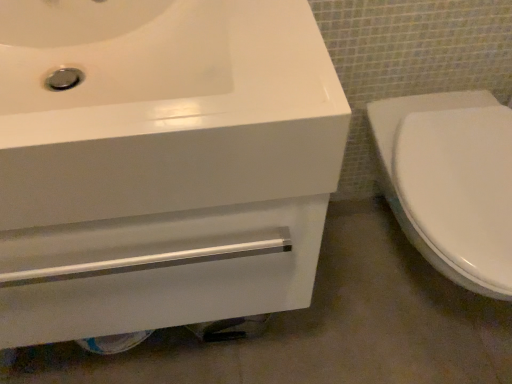
Question: From a real-world perspective, is white glossy toilet at right below white glossy drawer at lower left?

Choices:
 (A) no
 (B) yes

Answer: (A)

Question: Are white glossy toilet at right and white glossy drawer at lower left far apart?

Choices:
 (A) no
 (B) yes

Answer: (A)

Question: Does white glossy toilet at right lie behind white glossy drawer at lower left?

Choices:
 (A) no
 (B) yes

Answer: (A)

Question: From the image's perspective, would you say white glossy toilet at right is positioned over white glossy drawer at lower left?

Choices:
 (A) no
 (B) yes

Answer: (B)

Question: Would you say white glossy toilet at right is outside white glossy drawer at lower left?

Choices:
 (A) no
 (B) yes

Answer: (B)

Question: Looking at the image, does white glossy toilet at right seem bigger or smaller compared to white glossy sink at upper left?

Choices:
 (A) small
 (B) big

Answer: (A)

Question: Considering the positions of white glossy toilet at right and white glossy sink at upper left in the image, is white glossy toilet at right wider or thinner than white glossy sink at upper left?

Choices:
 (A) wide
 (B) thin

Answer: (A)

Question: From the image's perspective, relative to white glossy sink at upper left, is white glossy toilet at right above or below?

Choices:
 (A) above
 (B) below

Answer: (B)

Question: Is white glossy toilet at right situated inside white glossy sink at upper left or outside?

Choices:
 (A) outside
 (B) inside

Answer: (A)

Question: From a real-world perspective, relative to white glossy toilet at right, is white glossy sink at upper left vertically above or below?

Choices:
 (A) above
 (B) below

Answer: (A)

Question: Is white glossy sink at upper left taller or shorter than white glossy toilet at right?

Choices:
 (A) short
 (B) tall

Answer: (A)

Question: Considering the positions of white glossy sink at upper left and white glossy toilet at right in the image, is white glossy sink at upper left wider or thinner than white glossy toilet at right?

Choices:
 (A) thin
 (B) wide

Answer: (A)

Question: Is white glossy sink at upper left to the left or to the right of white glossy toilet at right in the image?

Choices:
 (A) right
 (B) left

Answer: (B)

Question: Is point (475, 178) positioned closer to the camera than point (102, 309)?

Choices:
 (A) closer
 (B) farther

Answer: (B)

Question: From their relative heights in the image, would you say white glossy toilet at right is taller or shorter than white glossy drawer at lower left?

Choices:
 (A) tall
 (B) short

Answer: (A)